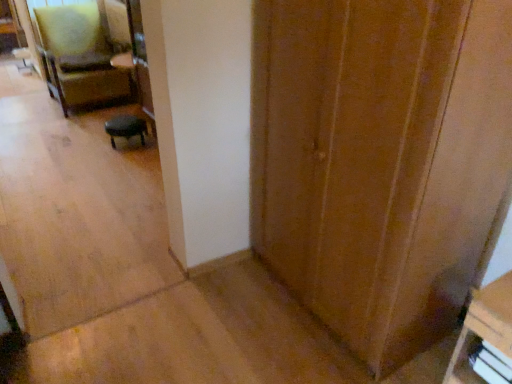
Question: From the image's perspective, is wooden door at center under black leather stool at center, the first furniture positioned from the top?

Choices:
 (A) yes
 (B) no

Answer: (A)

Question: From the image's perspective, is wooden door at center above black leather stool at center, placed as the 2th furniture when sorted from front to back?

Choices:
 (A) no
 (B) yes

Answer: (A)

Question: Is black leather stool at center, the first furniture positioned from the top, surrounded by wooden door at center?

Choices:
 (A) yes
 (B) no

Answer: (B)

Question: Can you confirm if wooden door at center is bigger than black leather stool at center, the second furniture in the bottom-to-top sequence?

Choices:
 (A) yes
 (B) no

Answer: (A)

Question: Could you tell me if wooden door at center is facing black leather stool at center, the first furniture positioned from the top?

Choices:
 (A) no
 (B) yes

Answer: (A)

Question: Would you say wooden door at center is to the left or to the right of velvet green armchair at upper left in the picture?

Choices:
 (A) right
 (B) left

Answer: (A)

Question: Is wooden door at center spatially inside velvet green armchair at upper left, or outside of it?

Choices:
 (A) outside
 (B) inside

Answer: (A)

Question: Is wooden door at center taller or shorter than velvet green armchair at upper left?

Choices:
 (A) short
 (B) tall

Answer: (B)

Question: Is point (492, 24) positioned closer to the camera than point (124, 89)?

Choices:
 (A) farther
 (B) closer

Answer: (B)

Question: From their relative heights in the image, would you say black leather stool at center, the first furniture positioned from the top, is taller or shorter than white plastic drawer at lower right?

Choices:
 (A) tall
 (B) short

Answer: (A)

Question: Is point (138, 122) closer or farther from the camera than point (501, 334)?

Choices:
 (A) farther
 (B) closer

Answer: (A)

Question: In the image, is black leather stool at center, placed as the 2th furniture when sorted from front to back, positioned in front of or behind white plastic drawer at lower right?

Choices:
 (A) front
 (B) behind

Answer: (B)

Question: Is black leather stool at center, which is the 1th furniture in back-to-front order, bigger or smaller than white plastic drawer at lower right?

Choices:
 (A) small
 (B) big

Answer: (B)

Question: Is wooden bookshelf at lower right, arranged as the 1th furniture when ordered from the bottom, inside the boundaries of wooden door at center, or outside?

Choices:
 (A) outside
 (B) inside

Answer: (A)

Question: Considering their positions, is wooden bookshelf at lower right, acting as the 2th furniture starting from the left, located in front of or behind wooden door at center?

Choices:
 (A) front
 (B) behind

Answer: (B)